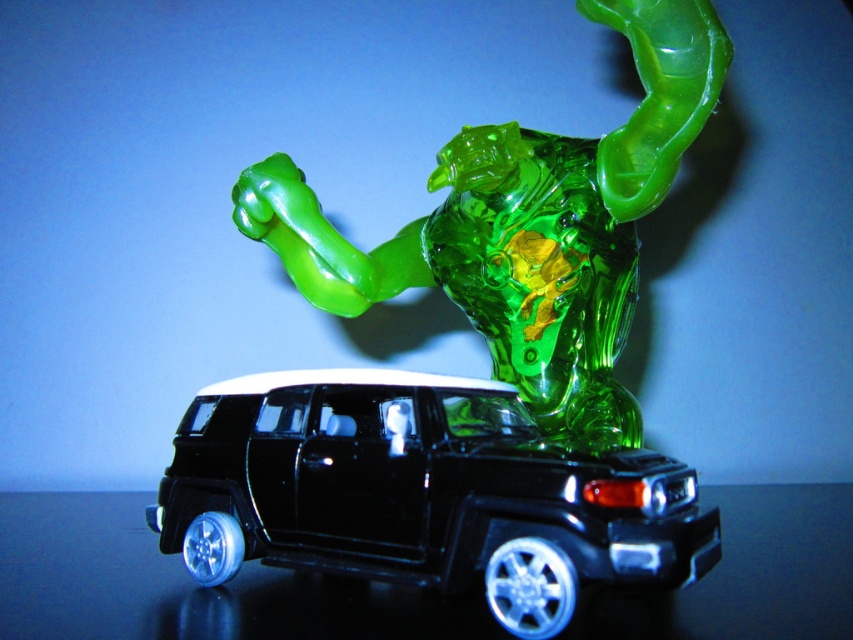
You are a child playing with the black plastic toy car at center and the translucent green figure at upper center. You want to place the car under the figure so it fits perfectly. Is the space between them enough for the car to be placed underneath without touching the figure?

The black plastic toy car at center is already positioned under the translucent green figure at upper center, so there is sufficient space for the car to be placed underneath without touching the figure.

You are a child trying to place a sticker on the black plastic toy car at center. The sticker is 2 cm wide. The toy car is 5 cm long. Can the sticker fit along the length of the toy car at center?

The toy car at center is 5 cm long, and the sticker is 2 cm wide. Since the length of the toy car is longer than the width of the sticker, the sticker can fit along the length of the toy car at center.